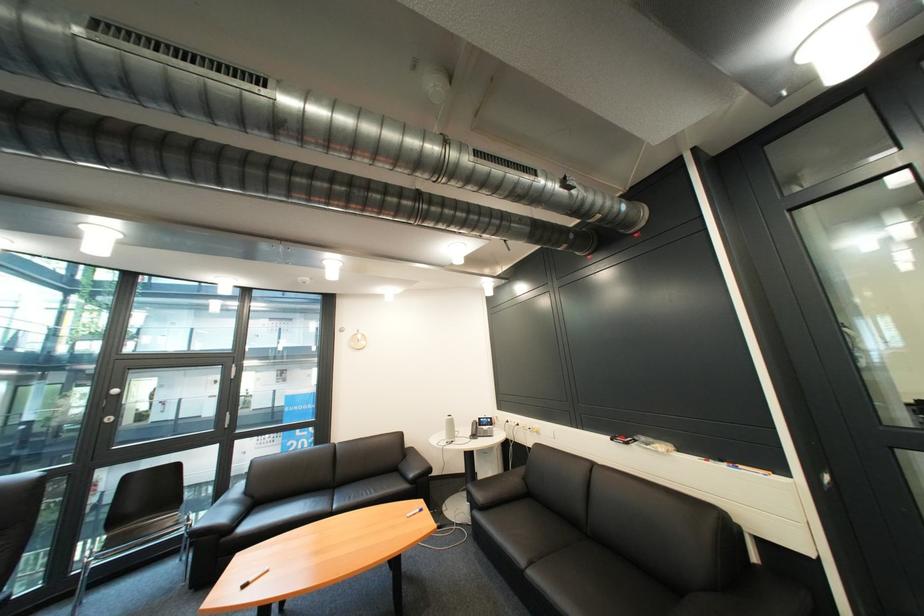
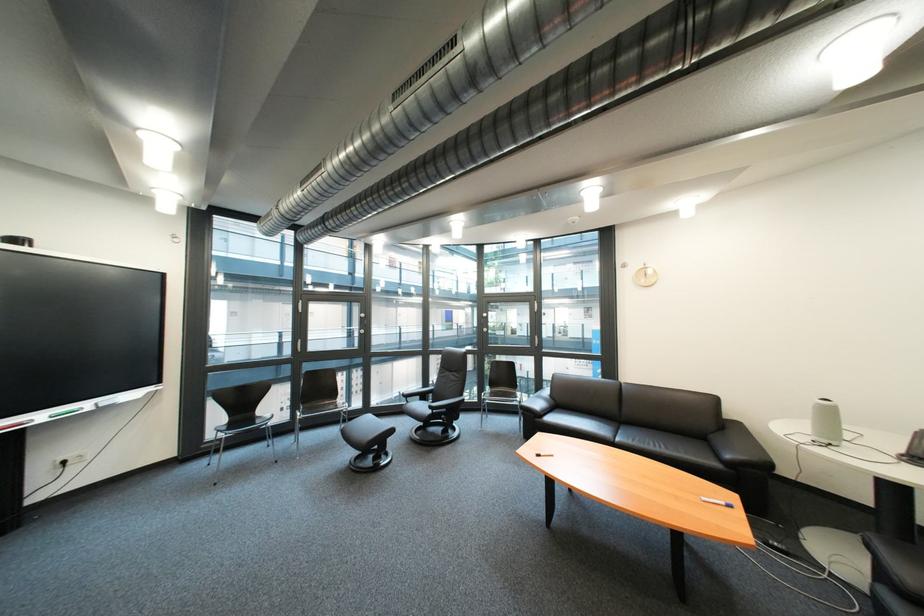
Where in the second image is the point corresponding to point (421, 517) from the first image?

(718, 501)